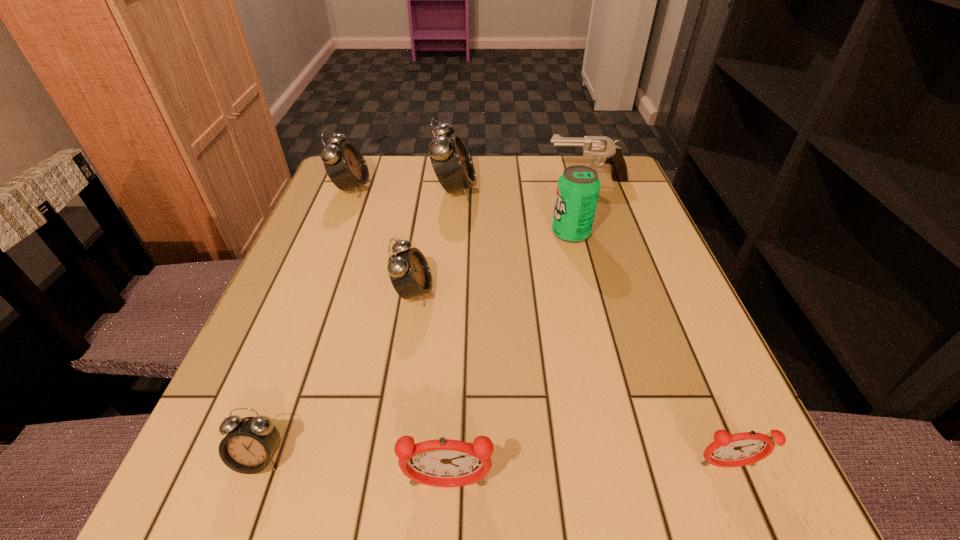
Where is `free space between the fifth nearest object and the left reddish-pink alarm clock`? The image size is (960, 540). free space between the fifth nearest object and the left reddish-pink alarm clock is located at coordinates (509, 359).

At what (x,y) coordinates should I click in order to perform the action: click on free space between the pop soda and the second biggest white alarm clock. Please return your answer as a coordinate pair (x, y). Image resolution: width=960 pixels, height=540 pixels. Looking at the image, I should click on (461, 211).

Where is `free space between the gun and the nearer reddish-pink alarm clock`? free space between the gun and the nearer reddish-pink alarm clock is located at coordinates (517, 332).

Locate an element on the screen. Image resolution: width=960 pixels, height=540 pixels. vacant area between the third smallest white alarm clock and the biggest white alarm clock is located at coordinates (403, 189).

Select which object is the seventh closest to the tallest object. Please provide its 2D coordinates. Your answer should be formatted as a tuple, i.e. [(x, y)], where the tuple contains the x and y coordinates of a point satisfying the conditions above.

[(740, 449)]

Locate an element on the screen. The width and height of the screenshot is (960, 540). the seventh closest object to the tallest object is located at coordinates [x=740, y=449].

Identify which alarm clock is the nearest to the third farthest white alarm clock. Please provide its 2D coordinates. Your answer should be formatted as a tuple, i.e. [(x, y)], where the tuple contains the x and y coordinates of a point satisfying the conditions above.

[(453, 166)]

Identify the location of the closest alarm clock to the fifth farthest object. (453, 166).

Identify which white alarm clock is located as the nearest to the smallest white alarm clock. Please provide its 2D coordinates. Your answer should be formatted as a tuple, i.e. [(x, y)], where the tuple contains the x and y coordinates of a point satisfying the conditions above.

[(409, 272)]

Choose which white alarm clock is the nearest neighbor to the second smallest white alarm clock. Please provide its 2D coordinates. Your answer should be formatted as a tuple, i.e. [(x, y)], where the tuple contains the x and y coordinates of a point satisfying the conditions above.

[(453, 166)]